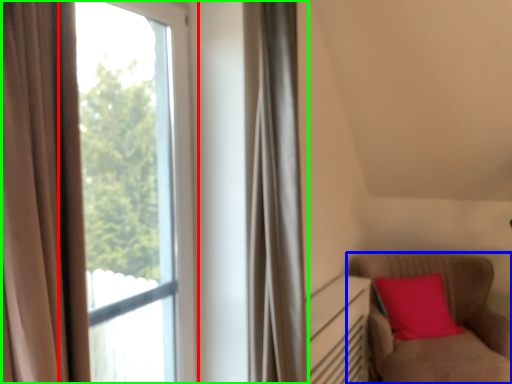
Question: Based on their relative distances, which object is farther from window (highlighted by a red box)? Choose from furniture (highlighted by a blue box) and window (highlighted by a green box).

Choices:
 (A) furniture
 (B) window

Answer: (B)